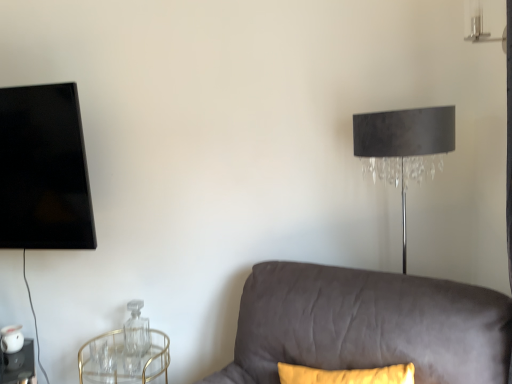
Question: Can you confirm if clear glass table at lower left is bigger than gold metallic round table at lower left?

Choices:
 (A) yes
 (B) no

Answer: (B)

Question: Is clear glass table at lower left not inside gold metallic round table at lower left?

Choices:
 (A) yes
 (B) no

Answer: (A)

Question: Does clear glass table at lower left turn towards gold metallic round table at lower left?

Choices:
 (A) yes
 (B) no

Answer: (B)

Question: From the image's perspective, would you say clear glass table at lower left is positioned over gold metallic round table at lower left?

Choices:
 (A) yes
 (B) no

Answer: (B)

Question: Is clear glass table at lower left thinner than gold metallic round table at lower left?

Choices:
 (A) yes
 (B) no

Answer: (A)

Question: From a real-world perspective, relative to clear glass table at lower left, is suede gray couch at lower right vertically above or below?

Choices:
 (A) below
 (B) above

Answer: (B)

Question: Based on their sizes in the image, would you say suede gray couch at lower right is bigger or smaller than clear glass table at lower left?

Choices:
 (A) big
 (B) small

Answer: (A)

Question: Considering the positions of suede gray couch at lower right and clear glass table at lower left in the image, is suede gray couch at lower right taller or shorter than clear glass table at lower left?

Choices:
 (A) tall
 (B) short

Answer: (A)

Question: Would you say suede gray couch at lower right is to the left or to the right of clear glass table at lower left in the picture?

Choices:
 (A) left
 (B) right

Answer: (B)

Question: Considering their positions, is suede gray couch at lower right located in front of or behind transparent glass bottle at lower left?

Choices:
 (A) front
 (B) behind

Answer: (A)

Question: Is point (428, 342) positioned closer to the camera than point (126, 345)?

Choices:
 (A) closer
 (B) farther

Answer: (A)

Question: Is suede gray couch at lower right bigger or smaller than transparent glass bottle at lower left?

Choices:
 (A) big
 (B) small

Answer: (A)

Question: From the image's perspective, is suede gray couch at lower right positioned above or below transparent glass bottle at lower left?

Choices:
 (A) above
 (B) below

Answer: (A)

Question: Is transparent glass bottle at lower left inside the boundaries of clear glass table at lower left, or outside?

Choices:
 (A) outside
 (B) inside

Answer: (A)

Question: Is point (142, 301) closer or farther from the camera than point (5, 380)?

Choices:
 (A) closer
 (B) farther

Answer: (A)